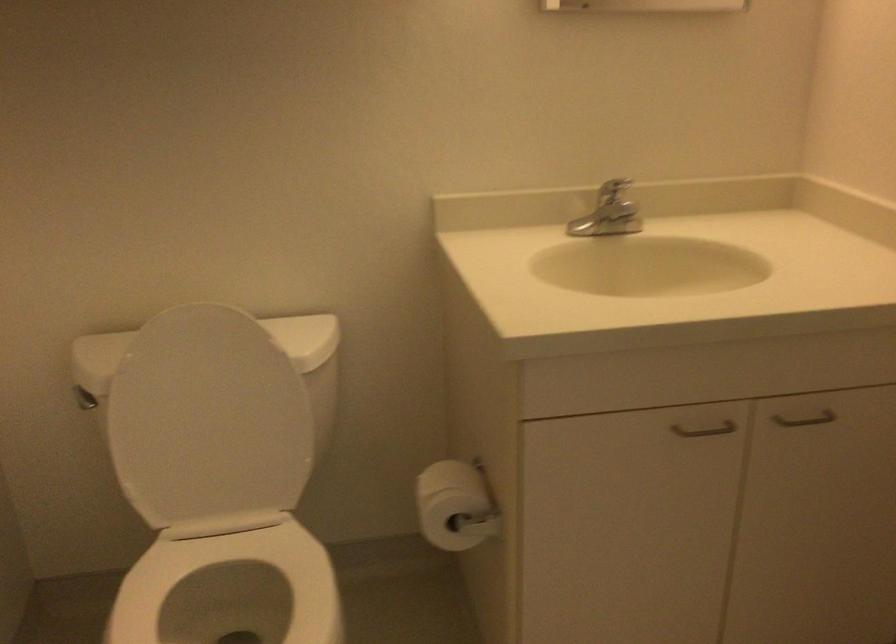
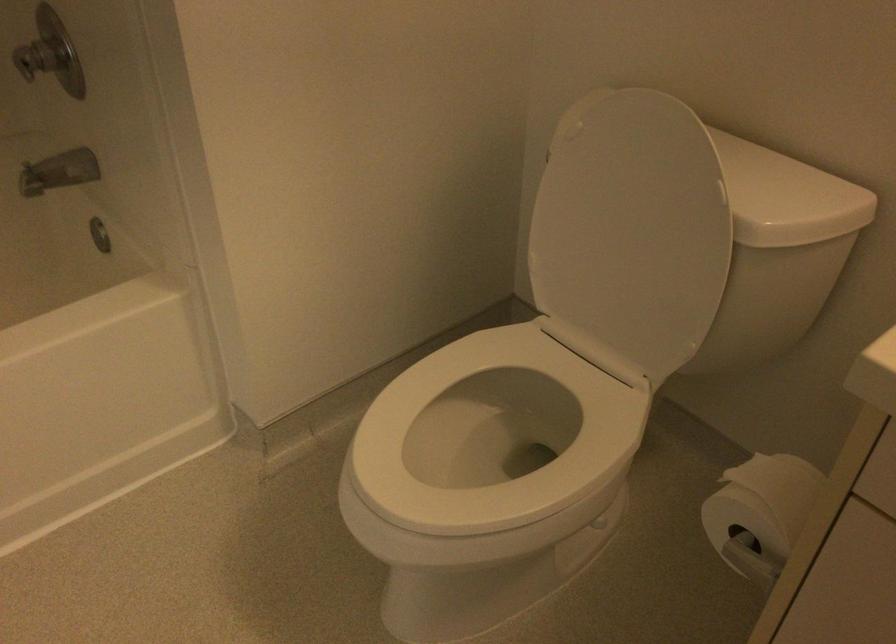
Locate, in the second image, the point that corresponds to (211,415) in the first image.

(631, 232)